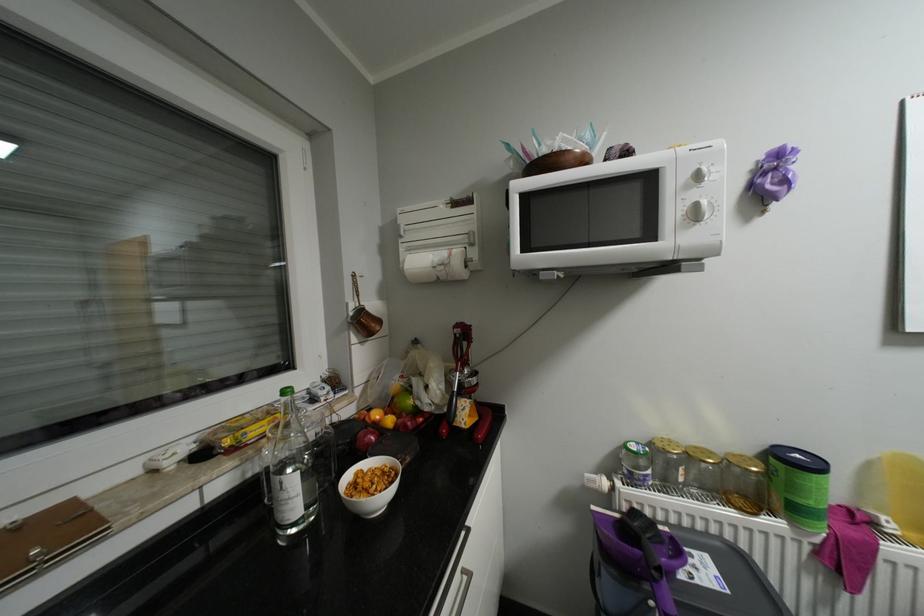
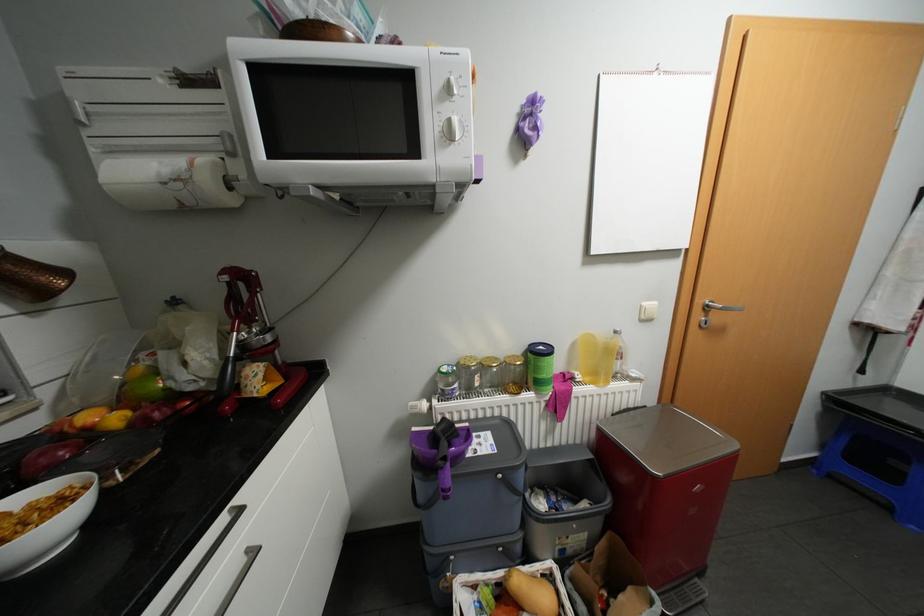
In the second image, find the point that corresponds to [718,451] in the first image.

(504, 358)